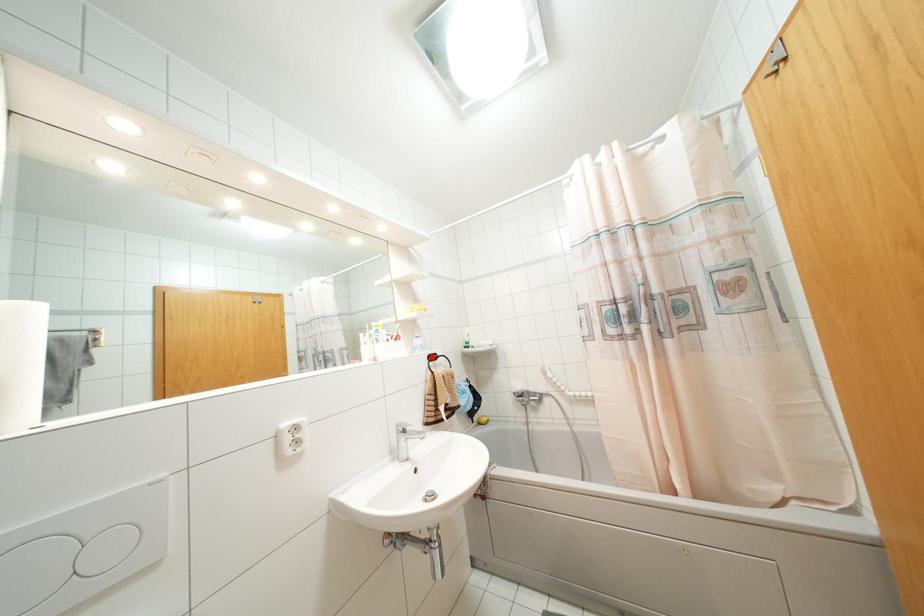
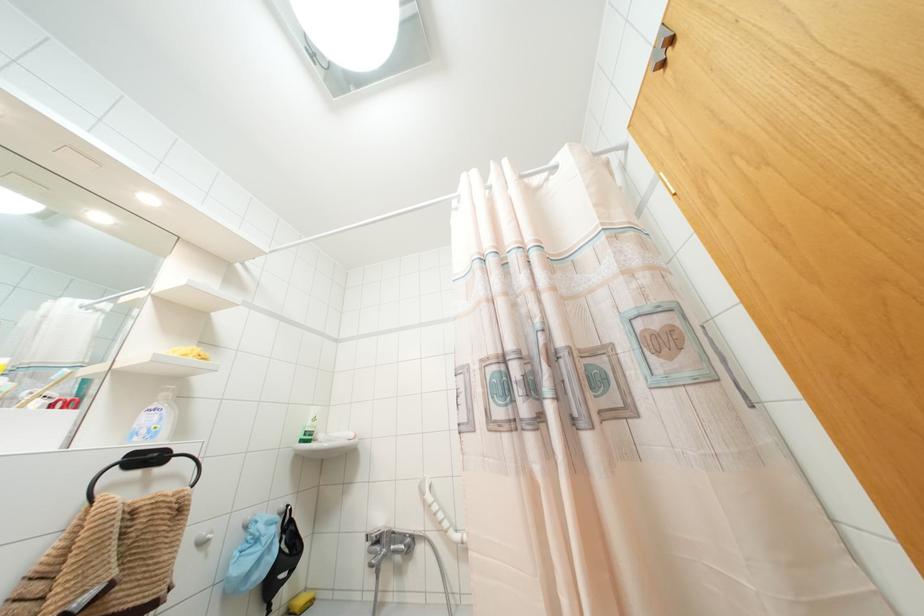
Locate, in the second image, the point that corresponds to the highlighted location in the first image.

(147, 458)